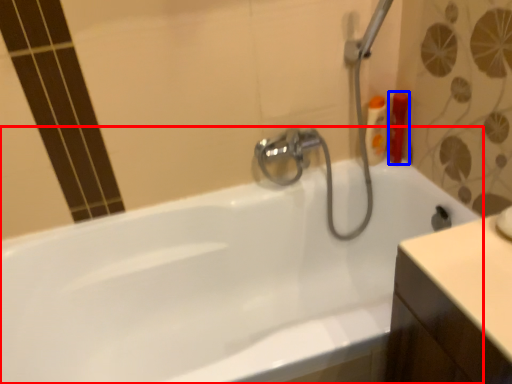
Question: Which of the following is the closest to the observer, bathtub (highlighted by a red box) or toiletry (highlighted by a blue box)?

Choices:
 (A) bathtub
 (B) toiletry

Answer: (A)